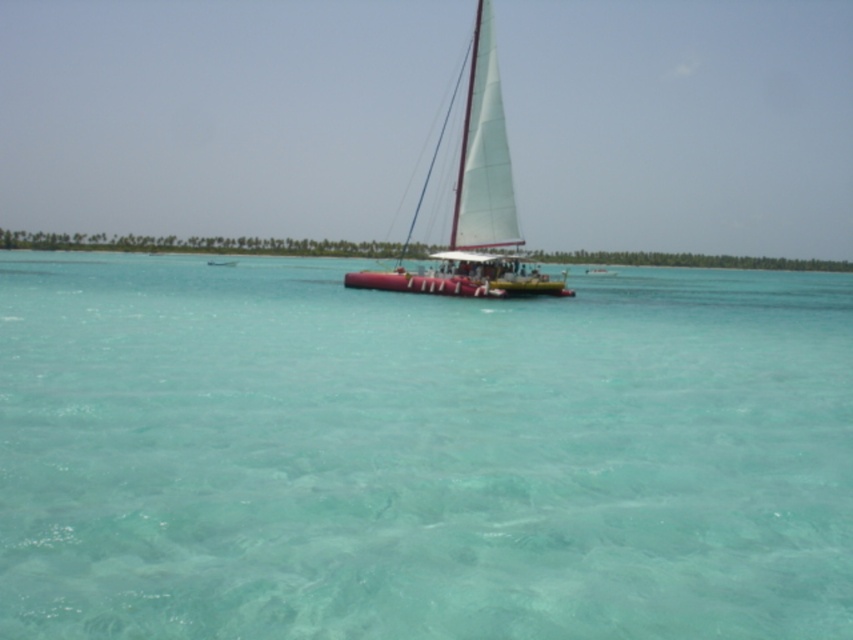
You are a sailor navigating a boat and need to avoid shallow waters. You see a point at coordinates (x=421, y=454) in the image. Based on the scene description, is the area at that point likely to be safe for your boat?

The point at coordinates (x=421, y=454) corresponds to clear water at center, which is part of the vibrant turquoise sea described as calm with gentle ripples. This area is likely safe for your boat as it is not indicated to be shallow or hazardous.

You are a sailor trying to navigate through the clear water at center and the white matte sailboat at center. Which object takes up more space in the image?

The white matte sailboat at center takes up more space in the image compared to the clear water at center, as it is larger in size.

You are standing on the deck of the catamaran and want to move from the point at coordinate point (7, 412) to the point at coordinate point (511, 182). Which direction should you move relative to the catamaran?

You should move towards the back of the catamaran because point (511, 182) is further away from the viewer compared to point (7, 412), which is closer.